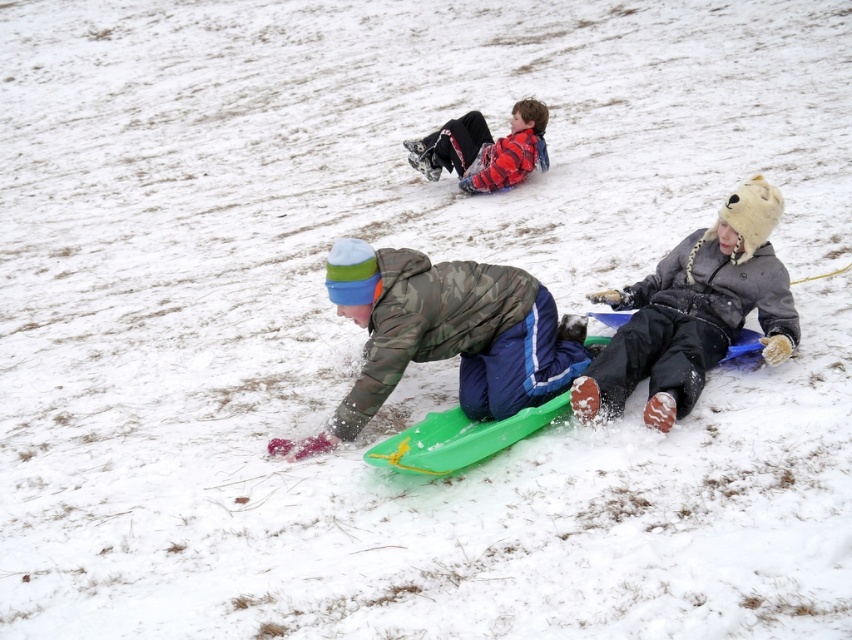
Question: Which is nearer to the red plaid shirt at center?

Choices:
 (A) green matte sled at center
 (B) gray fuzzy coat at lower right

Answer: (B)

Question: Does green matte sled at center come in front of red plaid shirt at center?

Choices:
 (A) no
 (B) yes

Answer: (B)

Question: In this image, where is gray fuzzy coat at lower right located relative to red plaid shirt at center?

Choices:
 (A) right
 (B) left

Answer: (A)

Question: Which object is farther from the camera taking this photo?

Choices:
 (A) gray fuzzy coat at lower right
 (B) red plaid shirt at center

Answer: (B)

Question: Which of these objects is positioned closest to the gray fuzzy coat at lower right?

Choices:
 (A) red plaid shirt at center
 (B) green matte sled at center

Answer: (B)

Question: Does gray fuzzy coat at lower right have a lesser width compared to red plaid shirt at center?

Choices:
 (A) yes
 (B) no

Answer: (A)